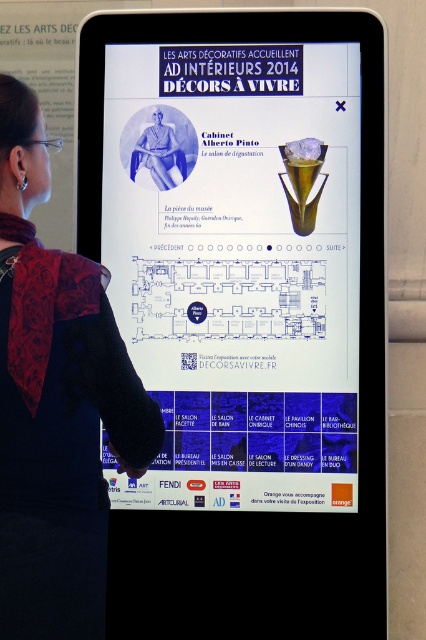
Can you confirm if white glossy poster at center is positioned above black fabric at upper left?

Yes, white glossy poster at center is above black fabric at upper left.

Between white glossy poster at center and black fabric at upper left, which one has less height?

With less height is black fabric at upper left.

Identify the location of white glossy poster at center. The width and height of the screenshot is (426, 640). (236, 269).